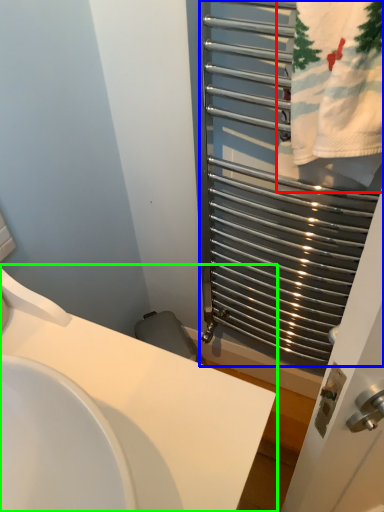
Question: Which object is the closest to the bath towel (highlighted by a red box)? Choose among these: cage (highlighted by a blue box) or sink (highlighted by a green box).

Choices:
 (A) cage
 (B) sink

Answer: (A)